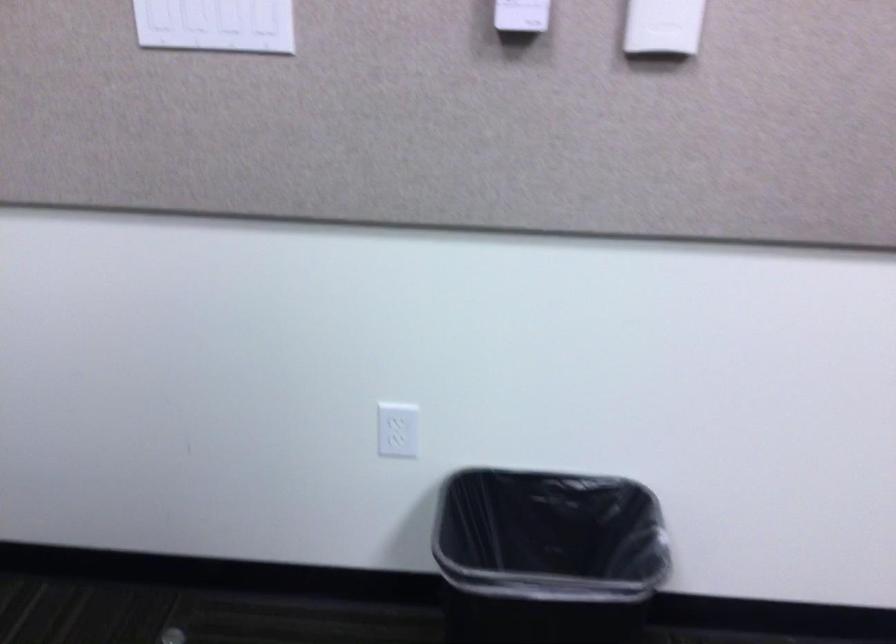
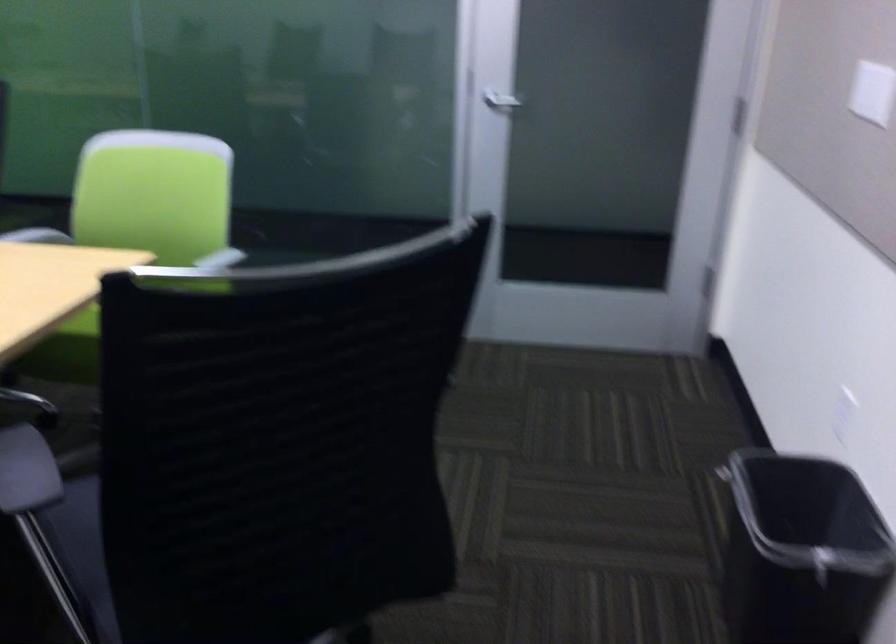
Find the pixel in the second image that matches (638,547) in the first image.

(800, 552)